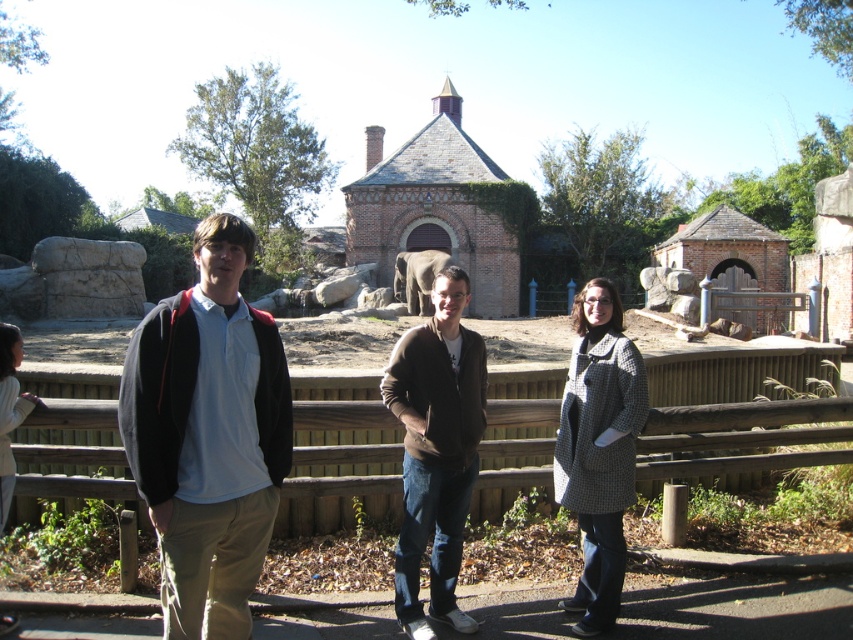
Question: Which point appears closest to the camera in this image?

Choices:
 (A) (619, 540)
 (B) (15, 420)
 (C) (106, 388)

Answer: (B)

Question: Among these objects, which one is farthest from the camera?

Choices:
 (A) wooden at center
 (B) gray matte elephant at center
 (C) brown sweater at center
 (D) houndstooth coat at center

Answer: (B)

Question: Can you confirm if wooden at center is positioned below gray matte elephant at center?

Choices:
 (A) no
 (B) yes

Answer: (B)

Question: Which of these objects is positioned farthest from the gray matte elephant at center?

Choices:
 (A) houndstooth coat at center
 (B) light gray sweater at center

Answer: (A)

Question: Does brown sweater at center have a smaller size compared to gray matte elephant at center?

Choices:
 (A) yes
 (B) no

Answer: (A)

Question: Is wooden at center thinner than houndstooth coat at center?

Choices:
 (A) yes
 (B) no

Answer: (A)